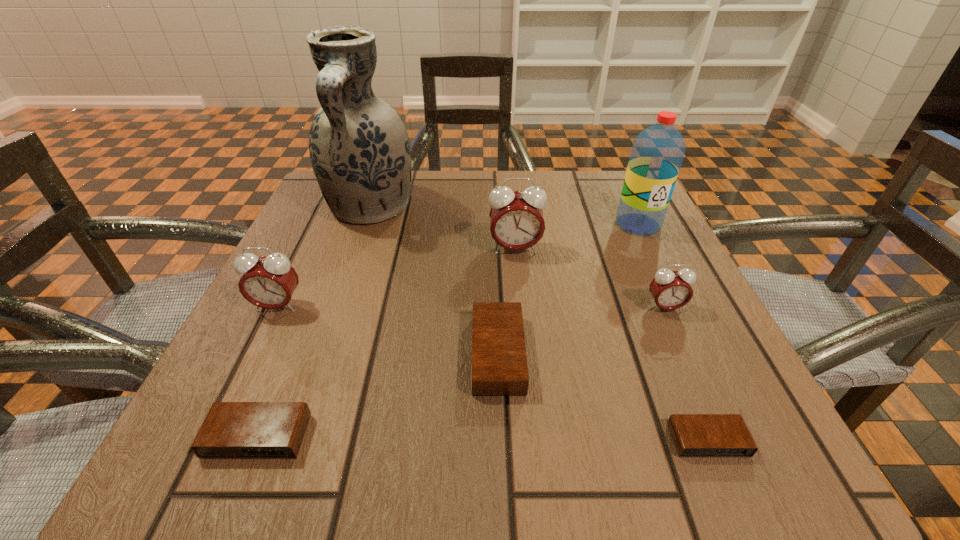
The height and width of the screenshot is (540, 960). I want to click on object present at the far right corner, so [657, 153].

The image size is (960, 540). I want to click on object at the near right corner, so click(694, 435).

You are a GUI agent. You are given a task and a screenshot of the screen. Output one action in this format:
    pyautogui.click(x=<x>, y=<y>)
    Task: Click on the vacant area at the far edge
    The image size is (960, 540).
    Given the screenshot: What is the action you would take?
    pyautogui.click(x=444, y=173)

In the image, there is a desktop. Identify the location of blank space at the near edge. (636, 436).

In the image, there is a desktop. At what (x,y) coordinates should I click in order to perform the action: click on vacant space at the left edge. Please return your answer as a coordinate pair (x, y). Looking at the image, I should click on (218, 370).

Where is `free space at the right edge of the desktop`? free space at the right edge of the desktop is located at coordinates (722, 376).

Locate an element on the screen. This screenshot has height=540, width=960. vacant region at the far right corner is located at coordinates (603, 186).

I want to click on vacant area between the second shortest alarm clock and the fourth tallest object, so click(x=268, y=371).

Image resolution: width=960 pixels, height=540 pixels. Identify the location of vacant area between the fifth tallest alarm clock and the tallest object. (314, 322).

The width and height of the screenshot is (960, 540). In order to click on free space between the second biggest pink alarm clock and the tallest object in this screenshot , I will do `click(324, 257)`.